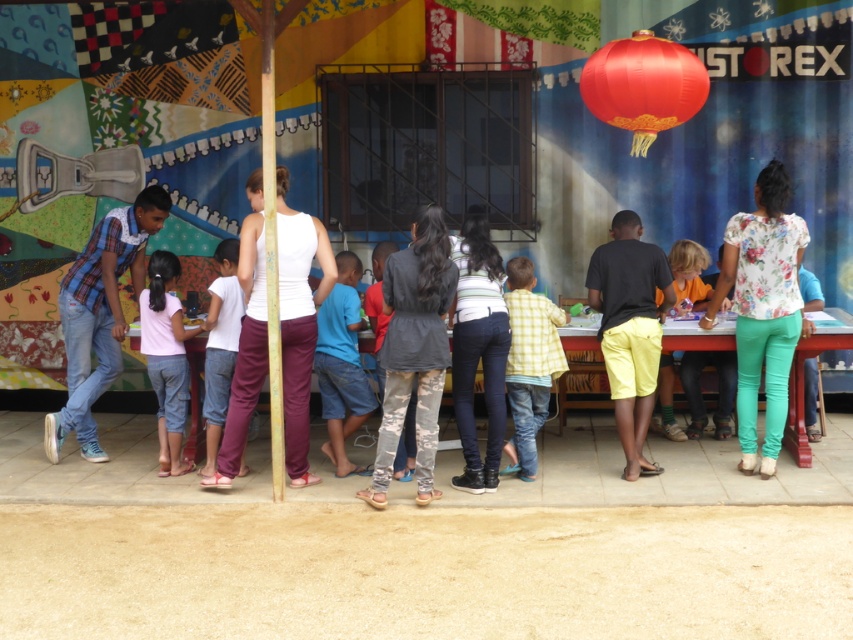
Which is more to the left, blue cotton shirt at center or pink cotton shirt at center?

From the viewer's perspective, pink cotton shirt at center appears more on the left side.

Who is more distant from viewer, (341, 276) or (178, 474)?

Point (341, 276)

Identify the location of blue cotton shirt at center. Image resolution: width=853 pixels, height=640 pixels. (341, 364).

Does point (624, 116) lie behind point (692, 428)?

No, (624, 116) is in front of (692, 428).

Where is `shiny red paper lantern at upper center`? shiny red paper lantern at upper center is located at coordinates (643, 84).

Does orange matte shirt at center have a lesser height compared to camouflage pants at center?

Indeed, orange matte shirt at center has a lesser height compared to camouflage pants at center.

Who is positioned more to the right, orange matte shirt at center or camouflage pants at center?

orange matte shirt at center is more to the right.

Is point (685, 433) less distant than point (378, 371)?

No.

Where is `orange matte shirt at center`? This screenshot has height=640, width=853. orange matte shirt at center is located at coordinates (700, 392).